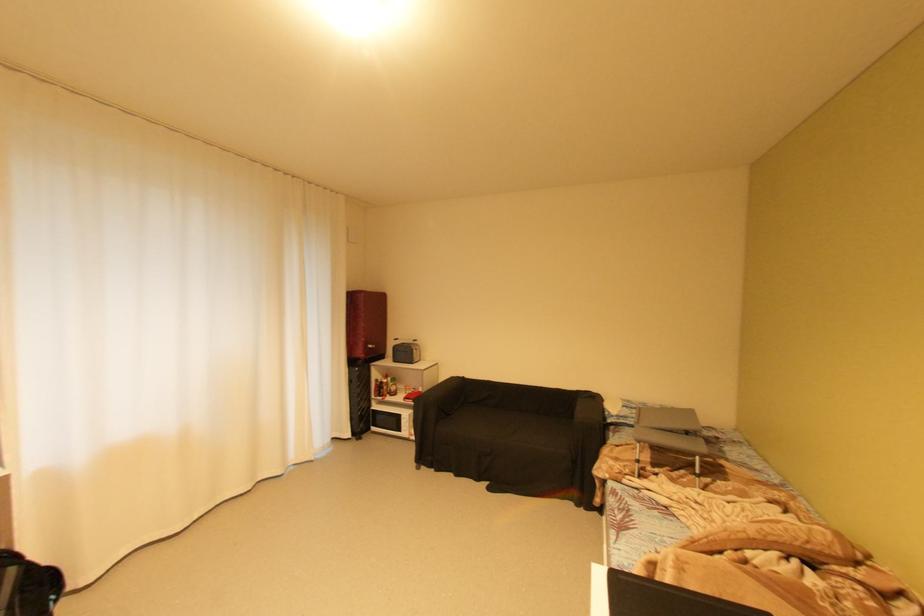
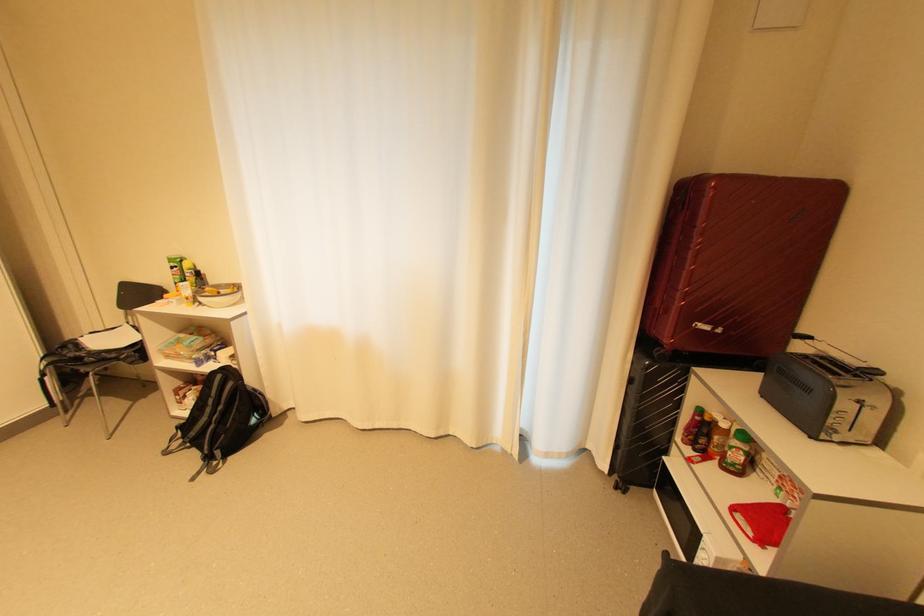
The point at (381, 398) is marked in the first image. Where is the corresponding point in the second image?

(686, 439)